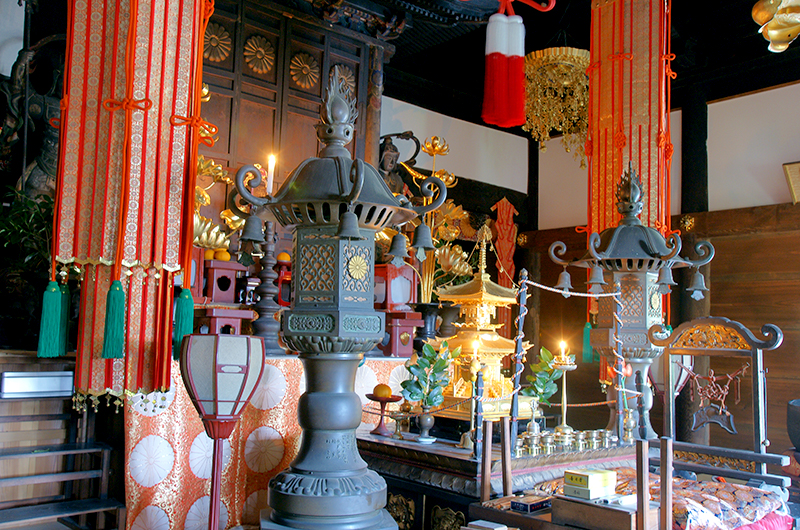
Find the location of a particular element. light is located at coordinates (210, 388).